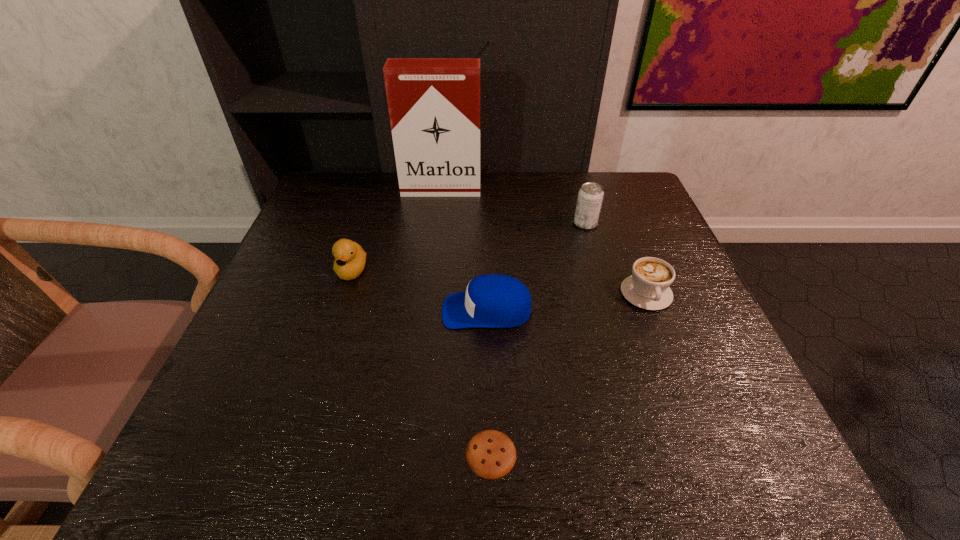
Locate an element on the screen. Image resolution: width=960 pixels, height=540 pixels. blank space that satisfies the following two spatial constraints: 1. on the front-facing side of the cookie; 2. on the left side of the baseball cap is located at coordinates tap(490, 454).

The height and width of the screenshot is (540, 960). Identify the location of vacant space that satisfies the following two spatial constraints: 1. on the face of the leftmost object; 2. on the left side of the cookie. (295, 454).

Find the location of `vacant space that satisfies the following two spatial constraints: 1. on the front-facing side of the baseball cap; 2. on the back side of the cookie`. vacant space that satisfies the following two spatial constraints: 1. on the front-facing side of the baseball cap; 2. on the back side of the cookie is located at coordinates (490, 454).

The width and height of the screenshot is (960, 540). In order to click on free space in the image that satisfies the following two spatial constraints: 1. on the front-facing side of the cigarette_case; 2. on the right side of the soda can in this screenshot , I will do `click(437, 224)`.

The height and width of the screenshot is (540, 960). Find the location of `vacant space that satisfies the following two spatial constraints: 1. on the front-facing side of the second farthest object; 2. on the left side of the farthest object`. vacant space that satisfies the following two spatial constraints: 1. on the front-facing side of the second farthest object; 2. on the left side of the farthest object is located at coordinates (437, 224).

At what (x,y) coordinates should I click in order to perform the action: click on vacant space that satisfies the following two spatial constraints: 1. on the front-facing side of the cigarette_case; 2. on the right side of the shortest object. Please return your answer as a coordinate pair (x, y). The width and height of the screenshot is (960, 540). Looking at the image, I should click on (410, 454).